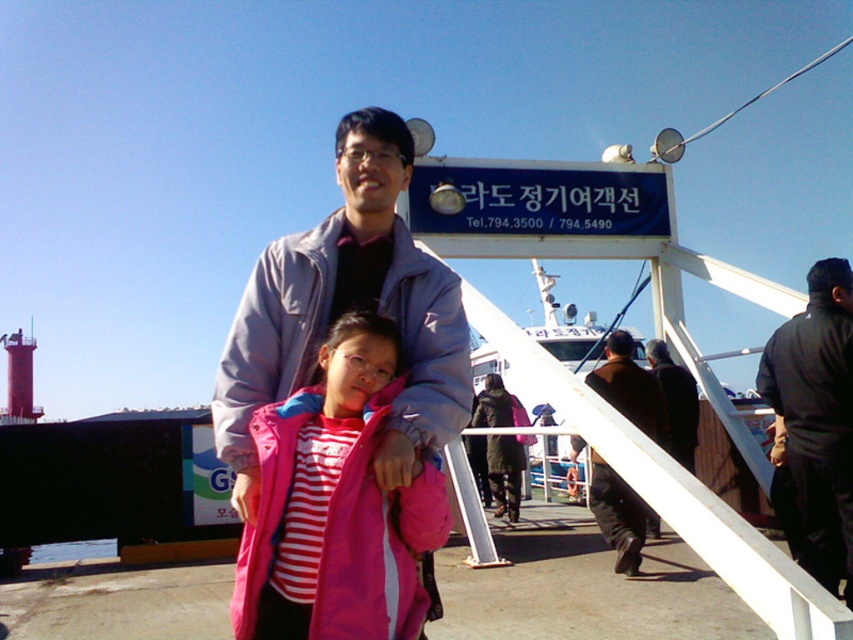
Question: Does blue plastic sign at upper center come in front of brown wool coat at center?

Choices:
 (A) no
 (B) yes

Answer: (A)

Question: Which point is farther to the camera?

Choices:
 (A) (289, 608)
 (B) (634, 572)

Answer: (B)

Question: Is brown wool coat at center closer to the viewer compared to dark brown leather jacket at center?

Choices:
 (A) yes
 (B) no

Answer: (A)

Question: Is brown wool coat at center thinner than dark green coat at center?

Choices:
 (A) yes
 (B) no

Answer: (B)

Question: Based on their relative distances, which object is farther from the pink fabric jacket at center?

Choices:
 (A) brown wool coat at center
 (B) blue plastic sign at upper center
 (C) black matte jacket at upper right

Answer: (B)

Question: Which point is farther to the camera?

Choices:
 (A) blue plastic sign at upper center
 (B) dark green coat at center

Answer: (B)